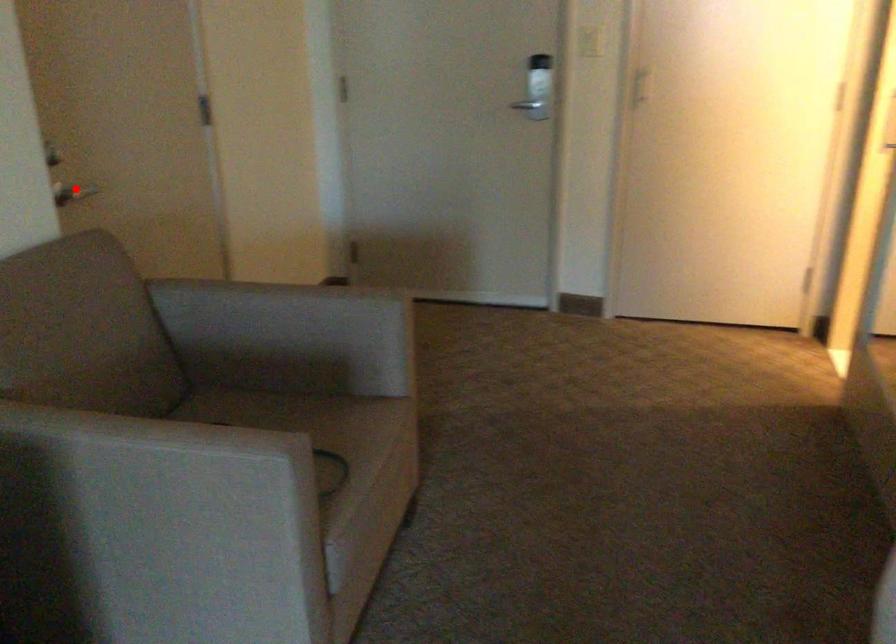
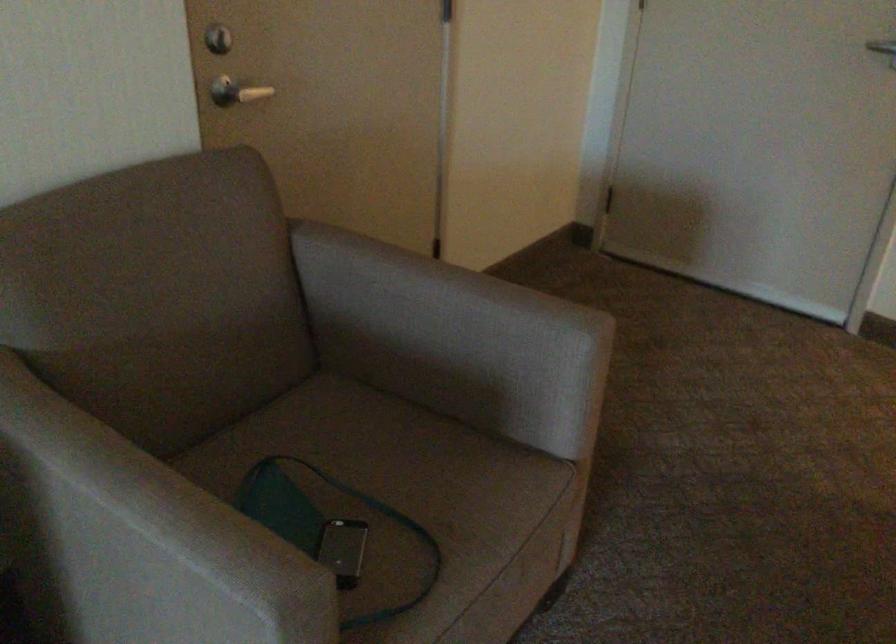
Question: I am providing you with two images of the same scene from different viewpoints. Image1 has a red point marked. In image2, the corresponding 3D location appears at what relative position? Reply with the corresponding letter.

Choices:
 (A) Closer
 (B) Farther

Answer: (A)